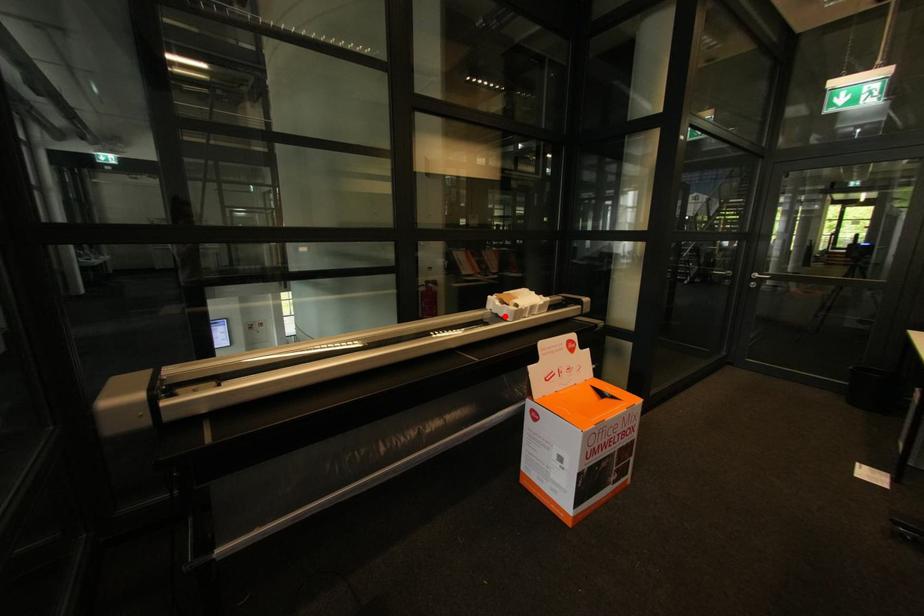
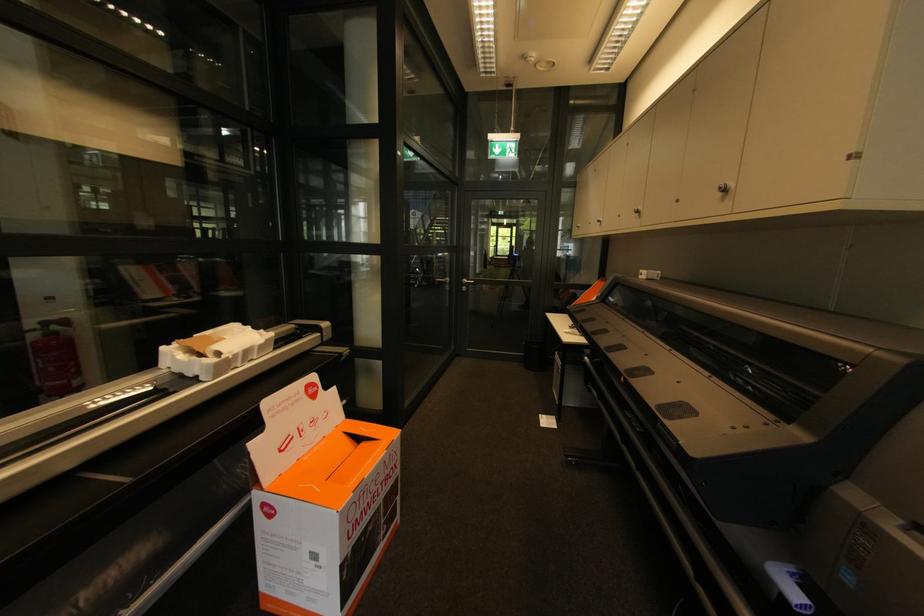
Locate, in the second image, the point that corresponds to the highlighted location in the first image.

(195, 376)